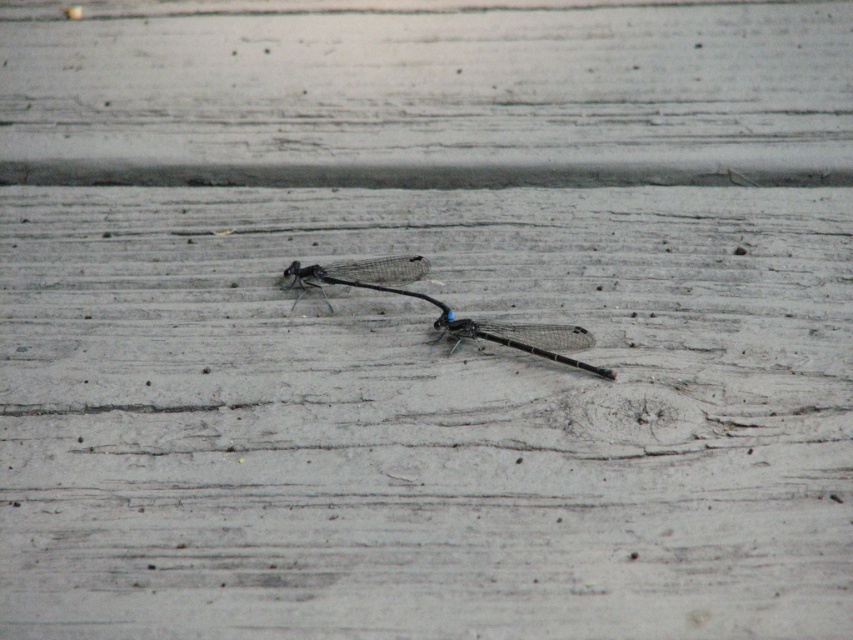
Question: Does matte black dragonfly at center appear under transparent glass dragonfly at center?

Choices:
 (A) yes
 (B) no

Answer: (A)

Question: Is the position of matte black dragonfly at center more distant than that of transparent glass dragonfly at center?

Choices:
 (A) no
 (B) yes

Answer: (A)

Question: Which point is farther to the camera?

Choices:
 (A) (529, 342)
 (B) (323, 276)

Answer: (B)

Question: Which object appears farthest from the camera in this image?

Choices:
 (A) transparent glass dragonfly at center
 (B) matte black dragonfly at center

Answer: (A)

Question: Which point is closer to the camera taking this photo?

Choices:
 (A) (578, 326)
 (B) (363, 280)

Answer: (A)

Question: Does matte black dragonfly at center come behind transparent glass dragonfly at center?

Choices:
 (A) no
 (B) yes

Answer: (A)